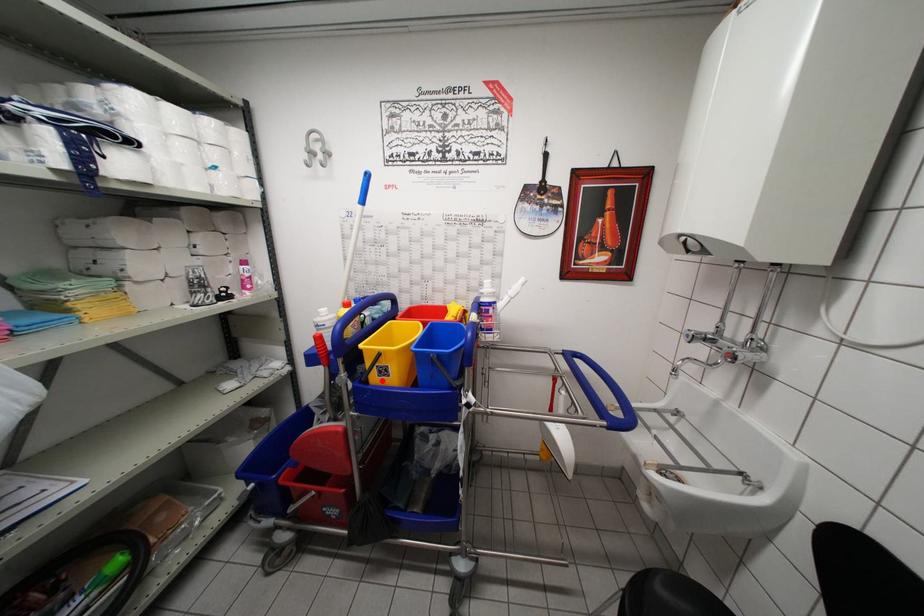
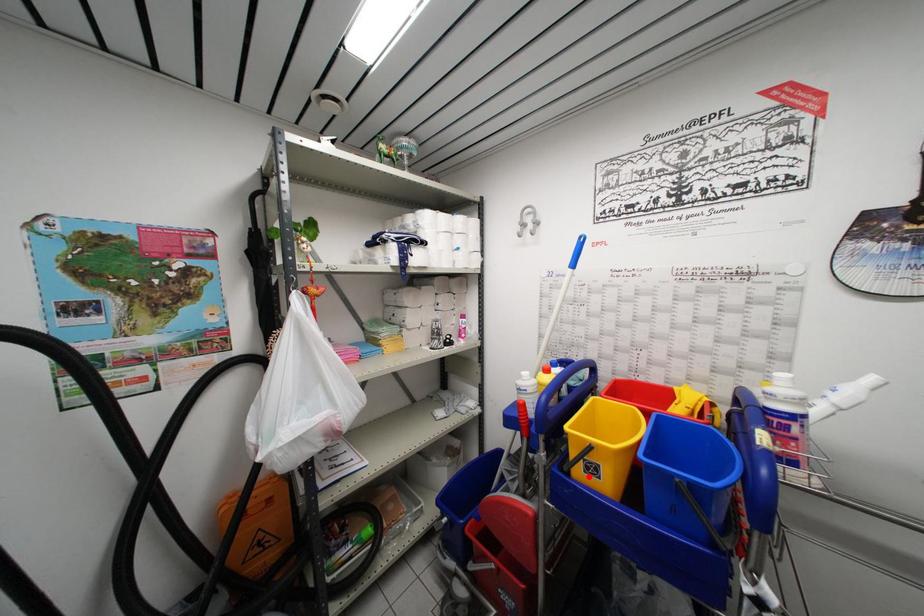
Looking at this image, I am providing you with two images of the same scene from different viewpoints. A red point is marked on the first image and another point is marked on the second image. Are the points marked in image1 and image2 representing the same 3D position?

Yes